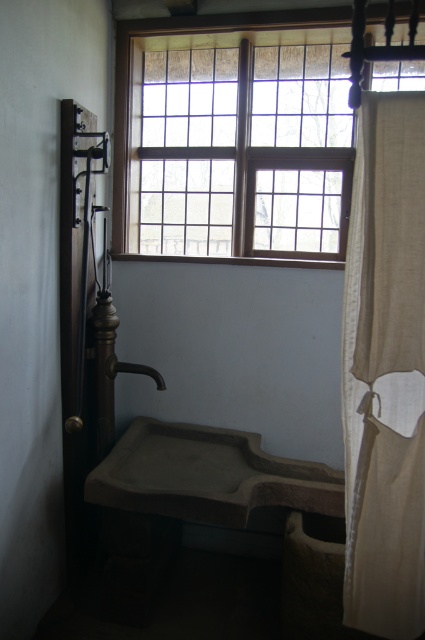
Question: Does beige fabric curtain at right appear on the left side of matte stone sink at lower left?

Choices:
 (A) no
 (B) yes

Answer: (A)

Question: Is wooden frame at upper center positioned in front of beige fabric curtain at right?

Choices:
 (A) yes
 (B) no

Answer: (B)

Question: Which point is closer to the camera taking this photo?

Choices:
 (A) (141, 371)
 (B) (272, 252)
 (C) (393, 282)
 (D) (305, 467)

Answer: (C)

Question: Among these objects, which one is nearest to the camera?

Choices:
 (A) beige fabric curtain at right
 (B) matte stone sink at lower left
 (C) wooden frame at upper center
 (D) matte brown faucet at lower center

Answer: (A)

Question: Which of these objects is positioned closest to the matte brown faucet at lower center?

Choices:
 (A) wooden frame at upper center
 (B) beige fabric curtain at right
 (C) matte stone sink at lower left

Answer: (C)

Question: Does wooden frame at upper center have a larger size compared to matte stone sink at lower left?

Choices:
 (A) no
 (B) yes

Answer: (B)